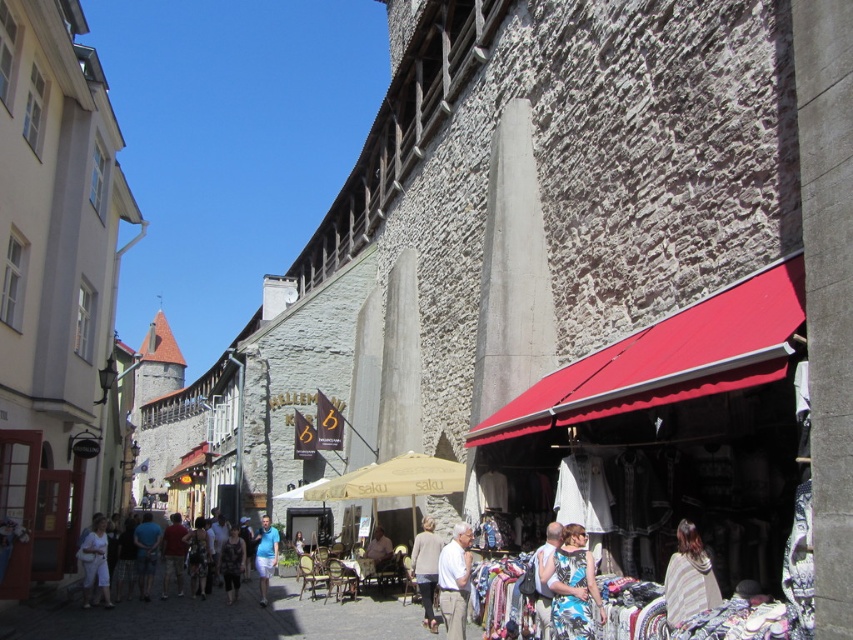
Question: Does blue floral dress at center appear on the right side of white cotton dress at lower left?

Choices:
 (A) yes
 (B) no

Answer: (A)

Question: Among these objects, which one is farthest from the camera?

Choices:
 (A) light brown leather shorts at center
 (B) blue floral dress at center
 (C) light brown leather jacket at lower center
 (D) red fabric awning at center

Answer: (A)

Question: Estimate the real-world distances between objects in this image. Which object is closer to the light brown leather jacket at lower center?

Choices:
 (A) red fabric awning at center
 (B) light brown leather shorts at center
 (C) light blue cotton shorts at center
 (D) light gray sweater at center

Answer: (A)

Question: Which of these objects is positioned farthest from the blue floral dress at center?

Choices:
 (A) dark gray fabric dress at center
 (B) light blue fabric shorts at center

Answer: (A)

Question: Can you confirm if blue floral dress at center is wider than light blue fabric shorts at center?

Choices:
 (A) no
 (B) yes

Answer: (A)

Question: Can you confirm if blue floral dress at center is positioned below striped fabric at center?

Choices:
 (A) no
 (B) yes

Answer: (B)